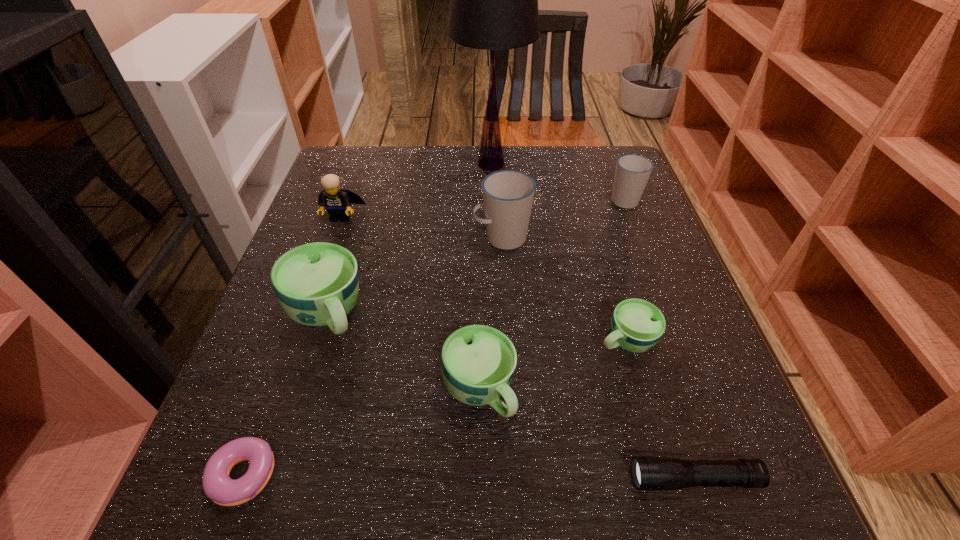
Where is `free space located with a handle on the side of the left white cup`? free space located with a handle on the side of the left white cup is located at coordinates (324, 238).

Identify the location of free region located with a handle on the side of the left white cup. (451, 238).

Where is `blank space located with a handle on the side of the left white cup`? The width and height of the screenshot is (960, 540). blank space located with a handle on the side of the left white cup is located at coordinates (434, 238).

Image resolution: width=960 pixels, height=540 pixels. Find the location of `vacant area located 0.290m on the front-facing side of the Lego`. vacant area located 0.290m on the front-facing side of the Lego is located at coordinates (303, 323).

Locate an element on the screen. This screenshot has width=960, height=540. vacant space located on the back of the leftmost cup is located at coordinates (344, 257).

Find the location of a particular element. The height and width of the screenshot is (540, 960). vacant space located with a handle on the side of the farthest cup is located at coordinates (608, 157).

Where is `free space located 0.160m on the back of the second shortest cup`? The width and height of the screenshot is (960, 540). free space located 0.160m on the back of the second shortest cup is located at coordinates (479, 288).

Where is `vacant space situated on the back of the rightmost blue cup`? vacant space situated on the back of the rightmost blue cup is located at coordinates (612, 289).

Where is `vacant space located at the lens end of the flashlight`? This screenshot has width=960, height=540. vacant space located at the lens end of the flashlight is located at coordinates (500, 479).

Image resolution: width=960 pixels, height=540 pixels. In order to click on vacant area situated 0.230m at the lens end of the flashlight in this screenshot , I will do `click(472, 479)`.